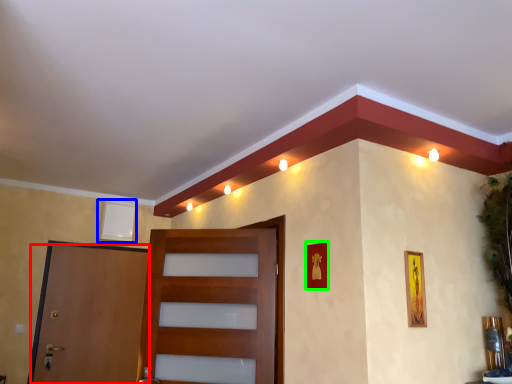
Question: Estimate the real-world distances between objects in this image. Which object is closer to door (highlighted by a red box), picture frame (highlighted by a blue box) or picture frame (highlighted by a green box)?

Choices:
 (A) picture frame
 (B) picture frame

Answer: (A)